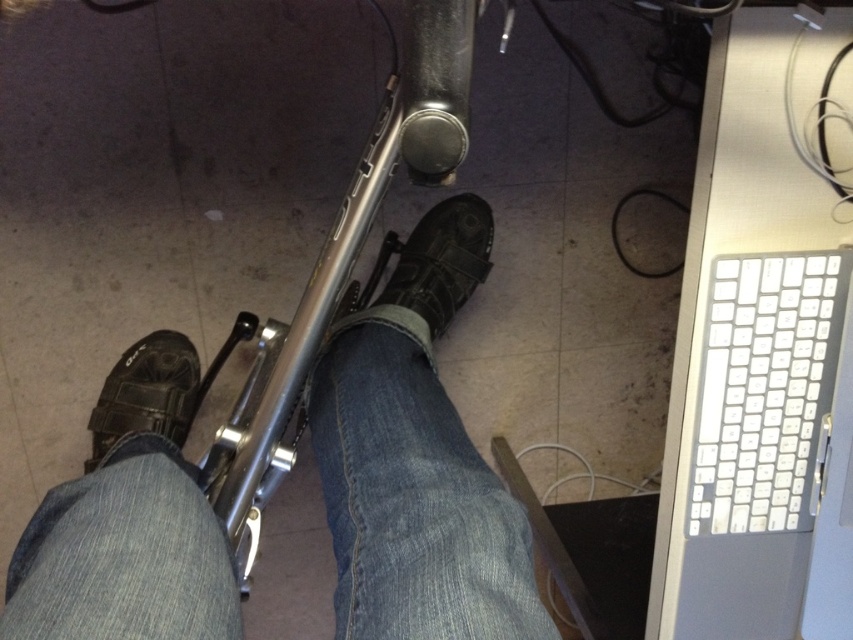
You are a physical therapist observing a patient exercising on a stationary bike. You notice two shoes on the pedals, a matte black shoe at center and a leather boot at center. Which shoe has a larger size?

The matte black shoe at center is bigger than the leather boot at center, so the matte black shoe at center has a larger size.

You are a delivery robot entering a room and need to place a package on the nearest flat surface. You see the denim at left and the white plastic keyboard at right. Which surface can you use?

The denim at left is larger in size than the white plastic keyboard at right, so the denim at left is a better option for placing the package as it provides a more stable and spacious surface.